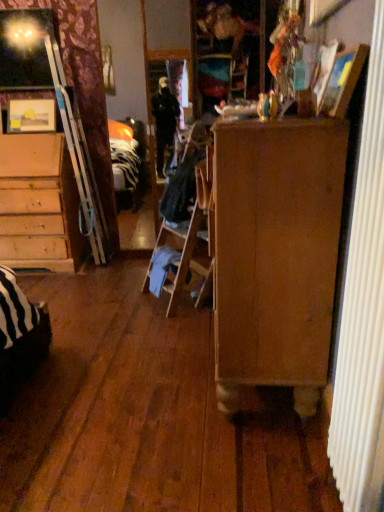
Question: Should I look upward or downward to see wooden chest of drawers at right?

Choices:
 (A) up
 (B) down

Answer: (A)